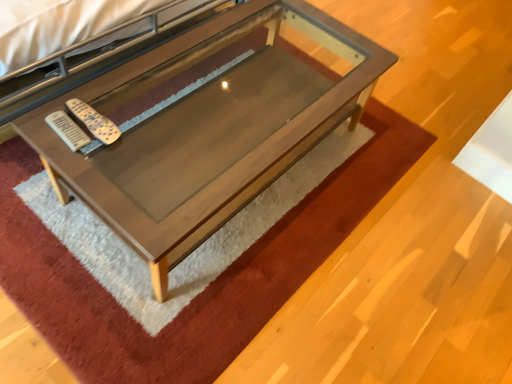
The image size is (512, 384). Find the location of `free space in front of white plastic remote at left, marked as the second remote in a right-to-left arrangement`. free space in front of white plastic remote at left, marked as the second remote in a right-to-left arrangement is located at coordinates (65, 158).